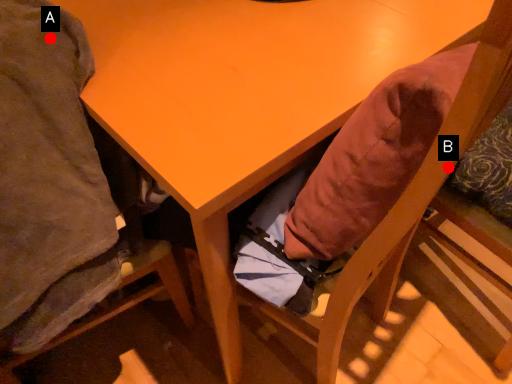
Question: Two points are circled on the image, labeled by A and B beside each circle. Which point is closer to the camera?

Choices:
 (A) A is closer
 (B) B is closer

Answer: (B)